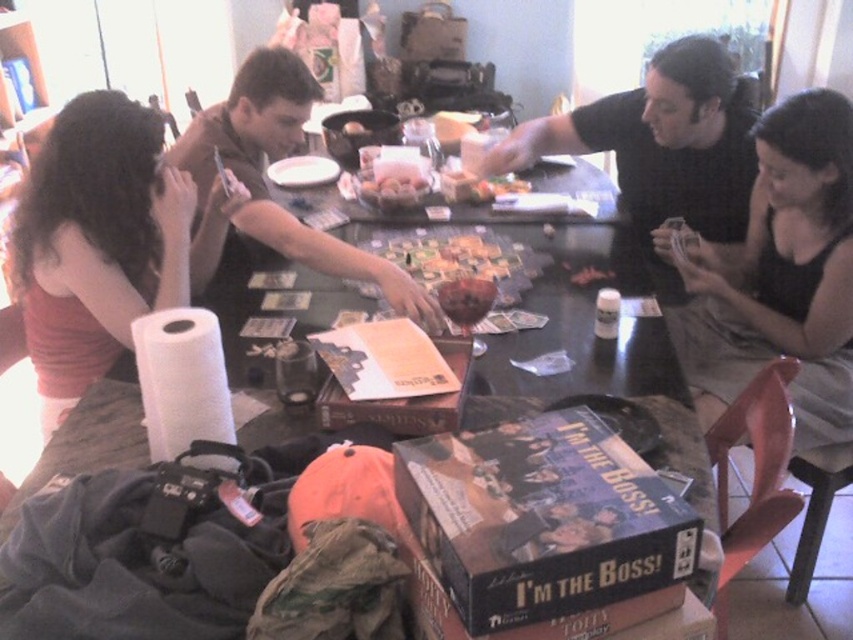
Question: Does black matte shirt at upper right have a lesser width compared to smooth red apple at center?

Choices:
 (A) no
 (B) yes

Answer: (A)

Question: From the image, what is the correct spatial relationship of matte red shirt at left in relation to smooth red apple at center?

Choices:
 (A) left
 (B) right

Answer: (A)

Question: Which is nearer to the smooth red apple at center?

Choices:
 (A) matte red shirt at left
 (B) matte black shirt at center
 (C) black fabric dress at lower right
 (D) black matte shirt at upper right

Answer: (B)

Question: Which point appears closest to the camera in this image?

Choices:
 (A) (473, 285)
 (B) (84, 385)
 (C) (718, 257)
 (D) (352, 260)

Answer: (A)

Question: Which point is farther to the camera?

Choices:
 (A) black fabric dress at lower right
 (B) black matte shirt at upper right
 (C) smooth red apple at center
 (D) matte black shirt at center

Answer: (B)

Question: Considering the relative positions of black fabric dress at lower right and black matte shirt at upper right in the image provided, where is black fabric dress at lower right located with respect to black matte shirt at upper right?

Choices:
 (A) right
 (B) left

Answer: (A)